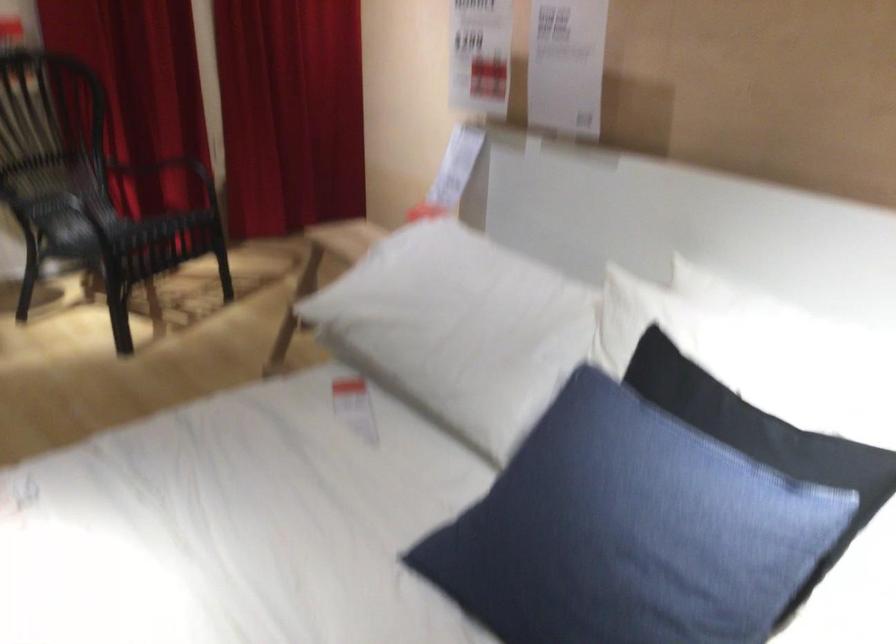
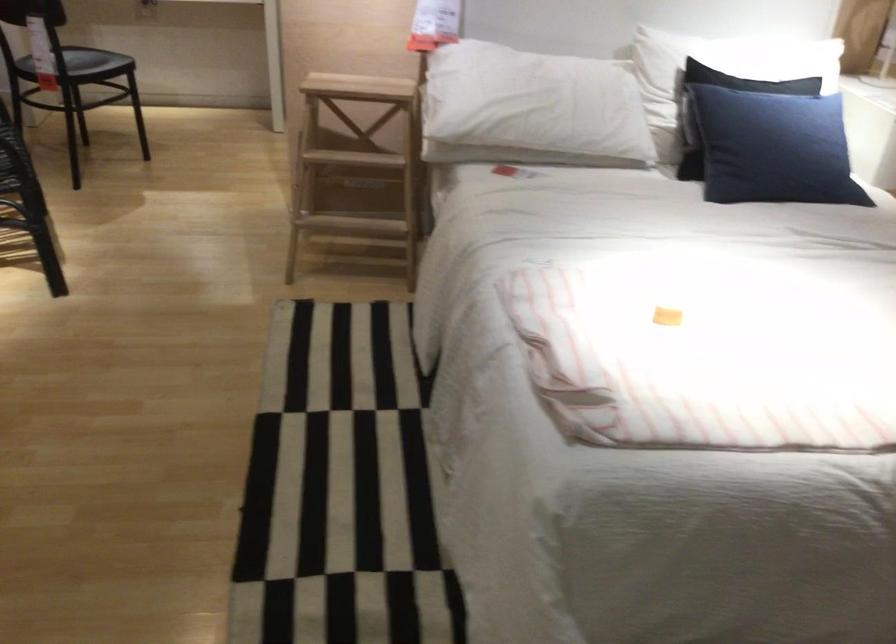
In the second image, find the point that corresponds to [426,328] in the first image.

(531, 108)